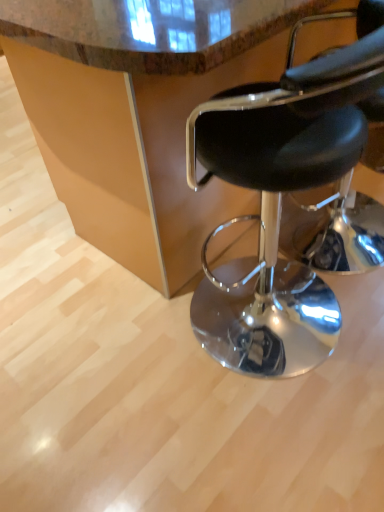
Question: From a real-world perspective, is black leather stool at right above or below marble countertop at center?

Choices:
 (A) above
 (B) below

Answer: (A)

Question: In terms of width, does black leather stool at right look wider or thinner when compared to marble countertop at center?

Choices:
 (A) wide
 (B) thin

Answer: (B)

Question: Visually, is black leather stool at right positioned to the left or to the right of marble countertop at center?

Choices:
 (A) right
 (B) left

Answer: (B)

Question: From a real-world perspective, is marble countertop at center physically located above or below black leather stool at right?

Choices:
 (A) above
 (B) below

Answer: (B)

Question: Is point pos(117,6) closer or farther from the camera than point pos(289,331)?

Choices:
 (A) closer
 (B) farther

Answer: (A)

Question: Is marble countertop at center bigger or smaller than black leather stool at right?

Choices:
 (A) small
 (B) big

Answer: (B)

Question: From the image's perspective, relative to black leather stool at right, is marble countertop at center above or below?

Choices:
 (A) above
 (B) below

Answer: (A)